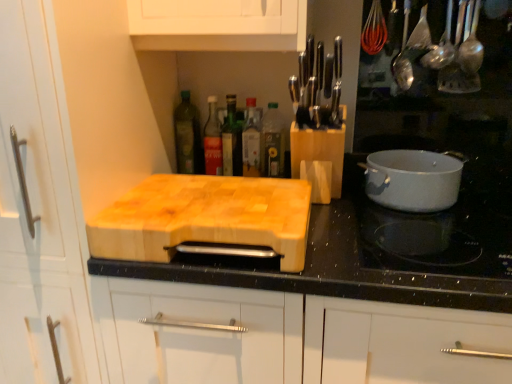
Find the location of a particular element. The height and width of the screenshot is (384, 512). free space in front of white glossy pot at right is located at coordinates (459, 227).